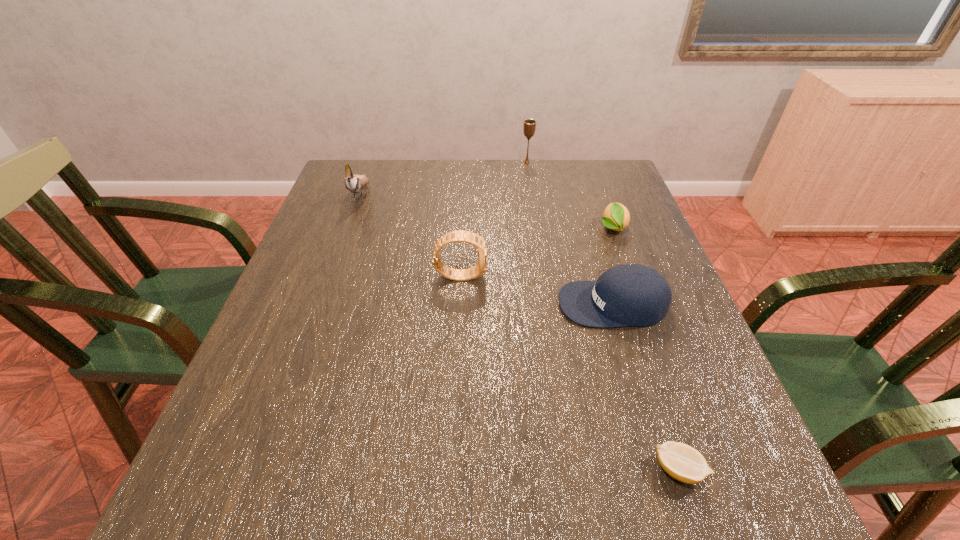
Where is `free space at the far right corner of the desktop`? free space at the far right corner of the desktop is located at coordinates (580, 178).

Locate an element on the screen. The width and height of the screenshot is (960, 540). vacant region between the second shortest object and the watch is located at coordinates (537, 252).

Image resolution: width=960 pixels, height=540 pixels. Identify the location of empty location between the second shortest object and the second object from left to right. (537, 252).

You are a GUI agent. You are given a task and a screenshot of the screen. Output one action in this format:
    pyautogui.click(x=<x>, y=<y>)
    Task: Click on the vacant region between the fourth tallest object and the watch
    
    Given the screenshot: What is the action you would take?
    pyautogui.click(x=537, y=289)

Where is `vacant space that's between the watch and the baseball cap`? vacant space that's between the watch and the baseball cap is located at coordinates [x=537, y=289].

You are a GUI agent. You are given a task and a screenshot of the screen. Output one action in this format:
    pyautogui.click(x=<x>, y=<y>)
    Task: Click on the free spot between the shortest object and the watch
    The width and height of the screenshot is (960, 540).
    Given the screenshot: What is the action you would take?
    pyautogui.click(x=570, y=373)

Locate an element on the screen. The width and height of the screenshot is (960, 540). free space between the farthest object and the leftmost object is located at coordinates (444, 178).

I want to click on empty space that is in between the fifth tallest object and the watch, so tap(537, 252).

You are a GUI agent. You are given a task and a screenshot of the screen. Output one action in this format:
    pyautogui.click(x=<x>, y=<y>)
    Task: Click on the unoccupied position between the farthest object and the second object from left to right
    The width and height of the screenshot is (960, 540).
    Given the screenshot: What is the action you would take?
    pyautogui.click(x=493, y=219)

Where is `free space between the farthest object and the baseball cap`? Image resolution: width=960 pixels, height=540 pixels. free space between the farthest object and the baseball cap is located at coordinates (570, 233).